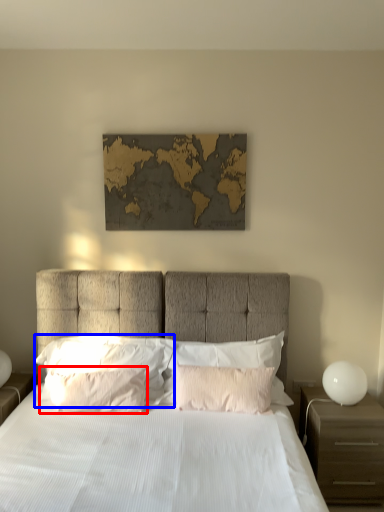
Question: Which object is closer to the camera taking this photo, pillow (highlighted by a red box) or pillow (highlighted by a blue box)?

Choices:
 (A) pillow
 (B) pillow

Answer: (A)